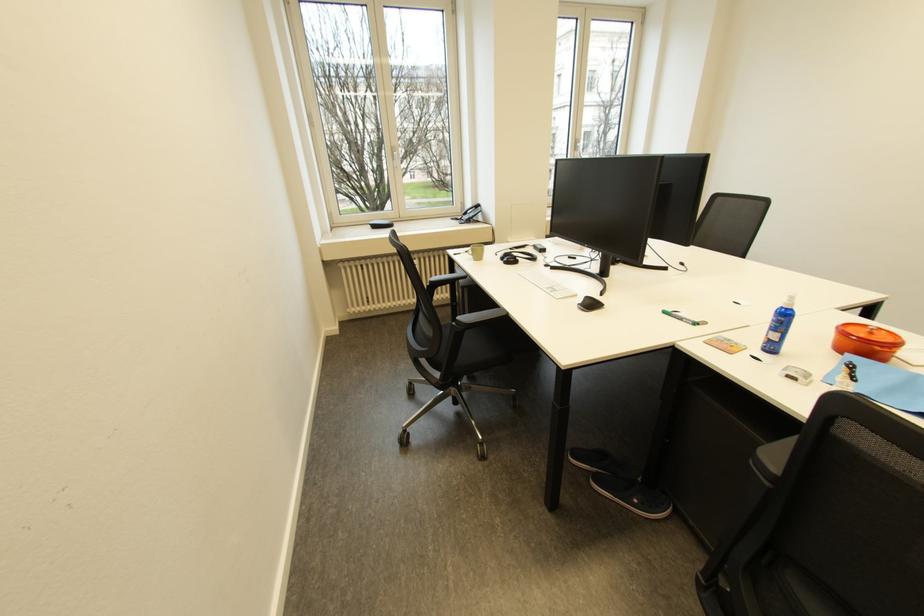
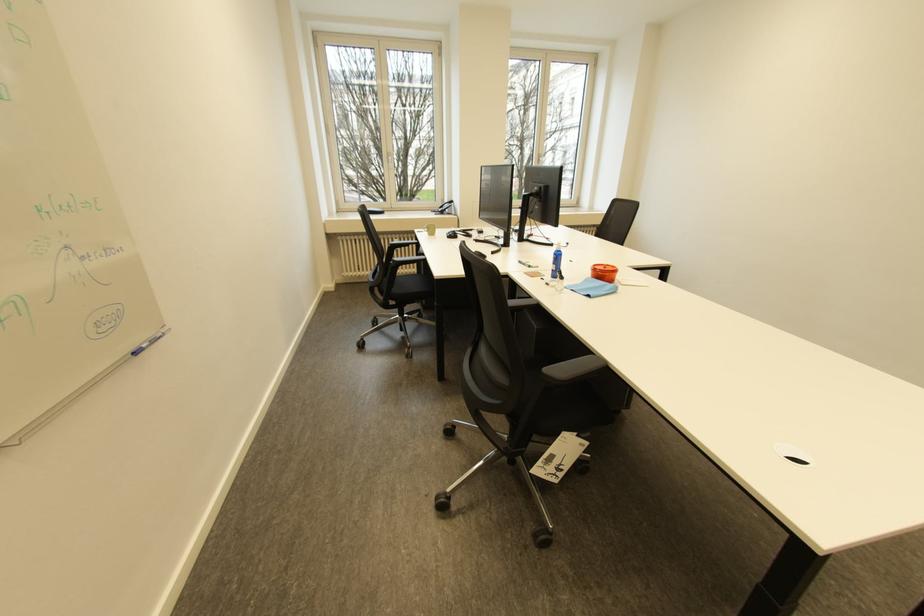
In the second image, find the point that corresponds to point (555, 265) in the first image.

(483, 241)